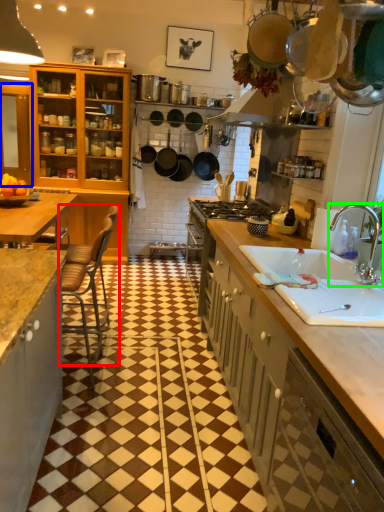
Question: Based on their relative distances, which object is nearer to chair (highlighted by a red box)? Choose from cabinetry (highlighted by a blue box) and tap (highlighted by a green box).

Choices:
 (A) cabinetry
 (B) tap

Answer: (B)